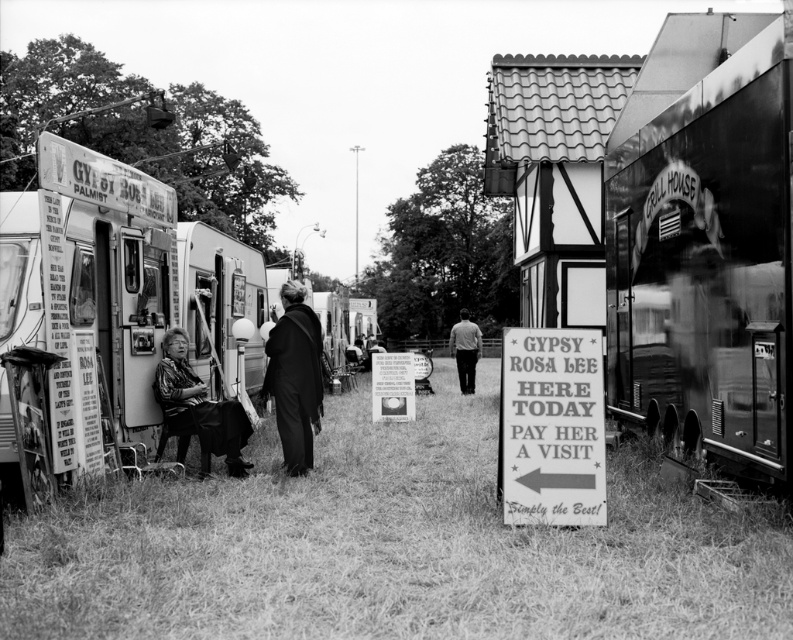
You are at a fair and want to locate the shiny black grill house at right. Which object should you look for that is much taller than the smooth black coat at center?

The shiny black grill house at right is much taller than the smooth black coat at center, so you should look for the object that towers over the smooth black coat at center.

You are a photographer trying to capture the Gypsy Rosa Lee Palmist trailer and the person in the smooth black coat at center in the same frame. Based on their positions, will both be visible in the photo if you focus on the shiny black grill house at right?

The shiny black grill house at right is in front of the smooth black coat at center, so if you focus on the shiny black grill house at right, the smooth black coat at center will be partially or fully blocked, making it less visible or not visible in the photo.

You are a photographer standing at the edge of the grassy field at center, aiming to capture a closeup of the smooth gray shirt at center. Given that your camera has a maximum focus range of 10 meters, will you be able to take the photo without moving closer?

The distance between the grassy field at center and the smooth gray shirt at center is 12.45 meters, which exceeds the camera maximum focus range of 10 meters. Therefore, you cannot take the photo without moving closer.